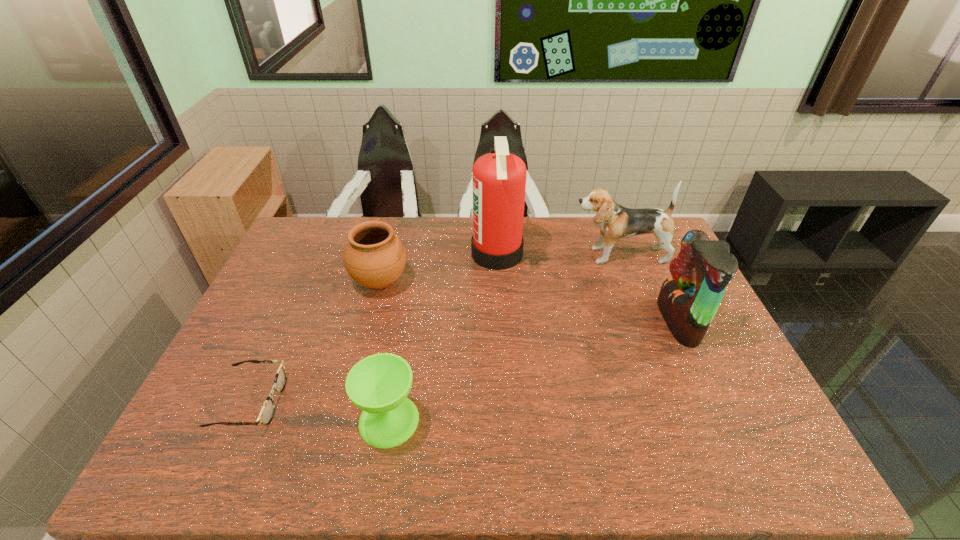
Locate an element on the screen. Image resolution: width=960 pixels, height=540 pixels. the tallest object is located at coordinates (499, 178).

The height and width of the screenshot is (540, 960). In order to click on fire extinguisher in this screenshot , I will do `click(499, 178)`.

The image size is (960, 540). I want to click on puppy, so click(x=616, y=222).

You are a GUI agent. You are given a task and a screenshot of the screen. Output one action in this format:
    pyautogui.click(x=<x>, y=<y>)
    Task: Click on the parrot
    
    Given the screenshot: What is the action you would take?
    pyautogui.click(x=688, y=300)

Locate an element on the screen. Image resolution: width=960 pixels, height=540 pixels. pottery is located at coordinates (374, 257).

Where is `the fifth tallest object`? This screenshot has height=540, width=960. the fifth tallest object is located at coordinates (379, 384).

Identify the location of the shortest object. The width and height of the screenshot is (960, 540). (266, 414).

Where is `the leftmost object`? the leftmost object is located at coordinates (266, 414).

Where is `vacant space located at the nozzle of the third object from right to left`? vacant space located at the nozzle of the third object from right to left is located at coordinates (428, 254).

This screenshot has width=960, height=540. I want to click on vacant space located 0.200m at the nozzle of the third object from right to left, so click(x=414, y=254).